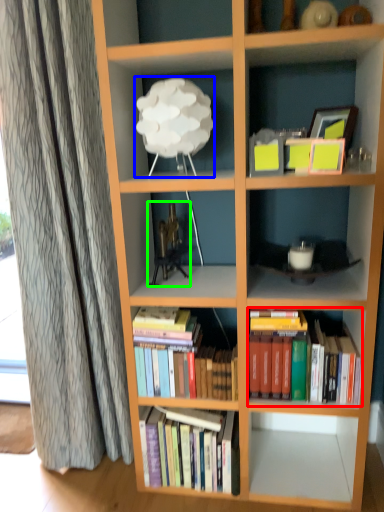
Question: Which is farther away from book (highlighted by a red box)? lamp (highlighted by a blue box) or toy (highlighted by a green box)?

Choices:
 (A) lamp
 (B) toy

Answer: (A)